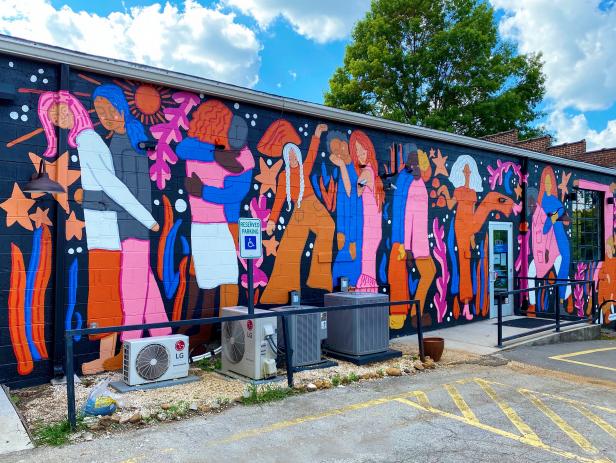
Find the location of a particular element. This screenshot has width=616, height=463. dark grey ac unit is located at coordinates (299, 321), (310, 343), (331, 316), (342, 338), (365, 317), (379, 331).